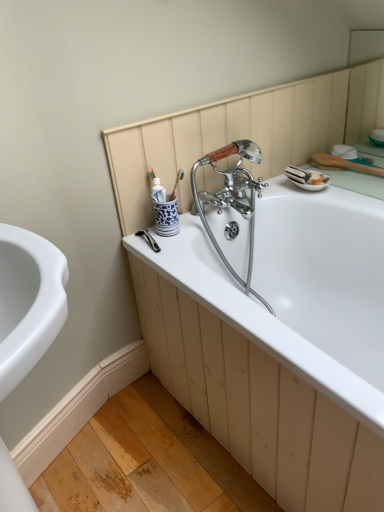
The image size is (384, 512). Describe the element at coordinates (299, 288) in the screenshot. I see `white ceramic bathtub at center` at that location.

This screenshot has height=512, width=384. I want to click on white ceramic bathtub at center, so click(x=299, y=288).

This screenshot has height=512, width=384. Identify the location of white ceramic bathtub at center. (299, 288).